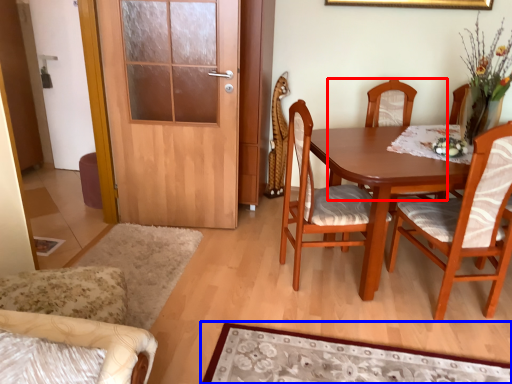
Question: Which point is further to the camera, chair (highlighted by a red box) or mat (highlighted by a blue box)?

Choices:
 (A) chair
 (B) mat

Answer: (A)